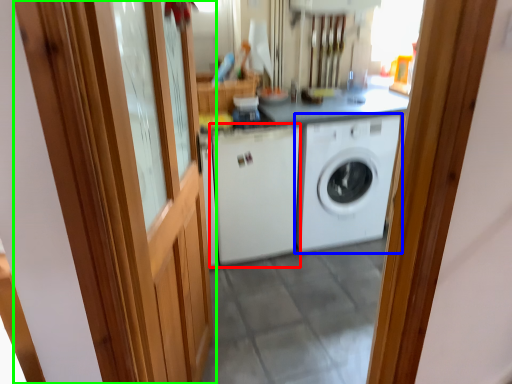
Question: Which is nearer to the washing machine (highlighted by a red box)? washing machine (highlighted by a blue box) or barn door (highlighted by a green box).

Choices:
 (A) washing machine
 (B) barn door

Answer: (A)